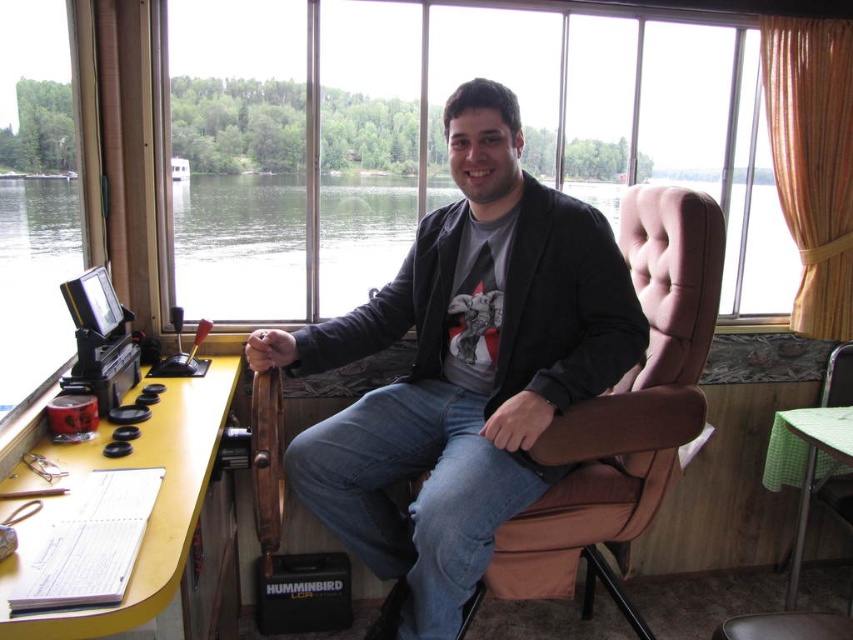
You are a delivery robot with a package that measures 12 inches in width. You need to place the package between the transparent glass window at center and the matte black jacket at center. Is there enough space for the package to fit without overlapping either object?

The distance between the transparent glass window at center and the matte black jacket at center is 34.36 inches. Since the package is only 12 inches wide, there is sufficient space to place it between them without overlapping either object.

You are organizing a small event in the room and need to place a centerpiece between the yellow wood table at lower left and the green checkered table at lower right. Based on their positions, which table should the centerpiece be closer to?

The yellow wood table at lower left is to the left of green checkered table at lower right, so the centerpiece should be placed closer to the green checkered table at lower right to maintain symmetry between the two tables.

You are a delivery person who needs to place a small package on the desk. The package is too heavy to lift over the desk edge. You can only slide it from the side. The desk has a yellow desk on the left side. Which object, the transparent glass window at center or the matte black jacket at center, is closer to the edge of the yellow desk on the left side where you can slide the package?

The matte black jacket at center is closer to the edge of the yellow desk on the left side than the transparent glass window at center, so you should slide the package towards the matte black jacket at center.